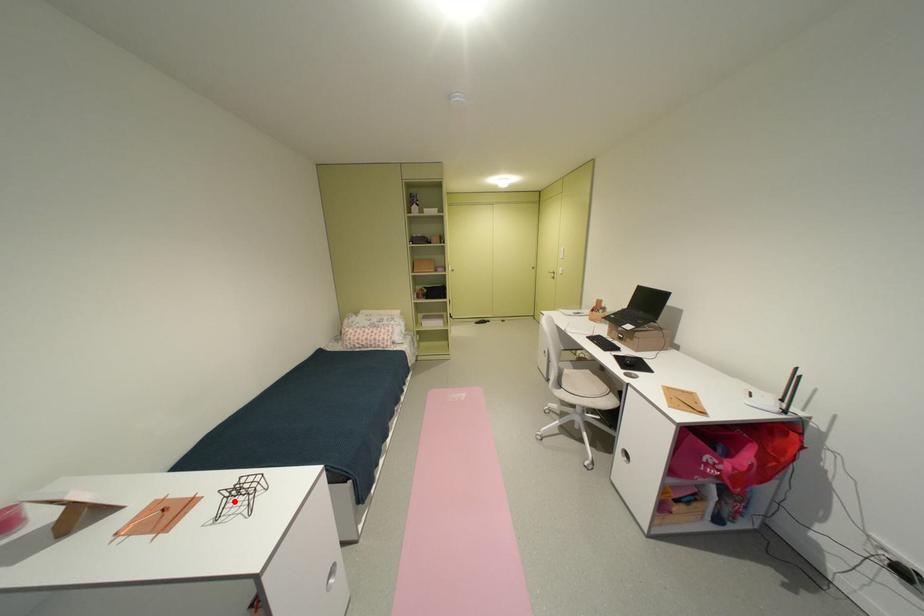
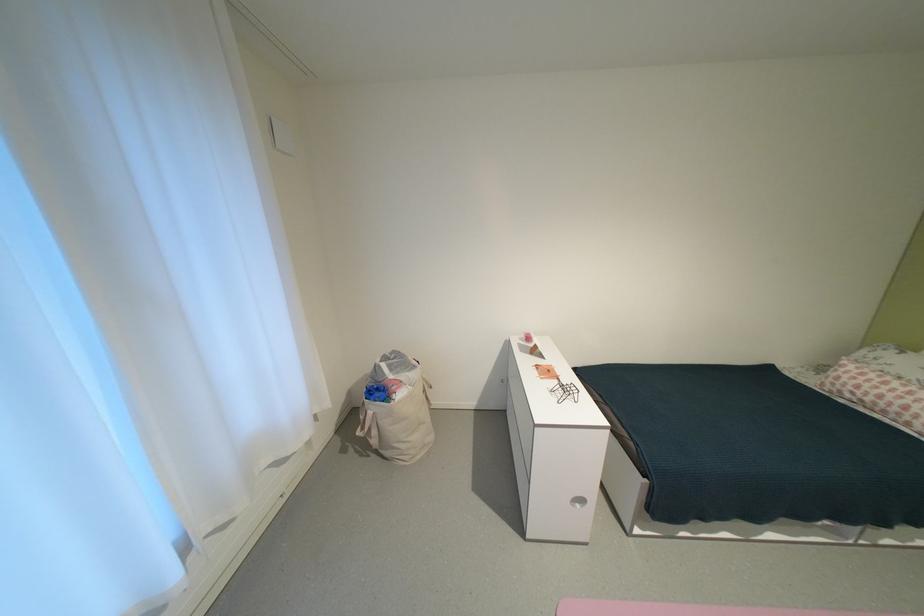
The point at the highlighted location is marked in the first image. Where is the corresponding point in the second image?

(568, 387)